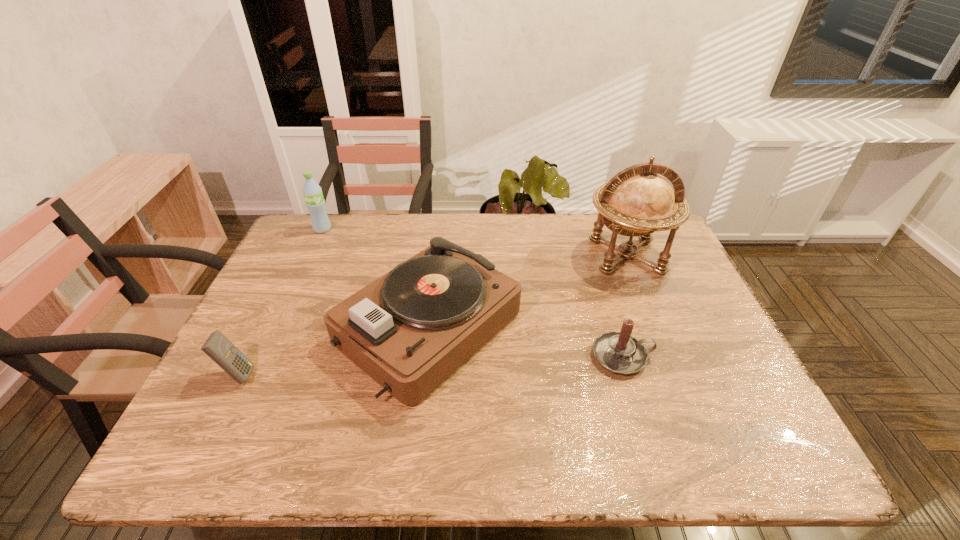
Identify the location of globe present at the far edge. (637, 201).

Identify the location of water bottle positioned at the far edge. This screenshot has width=960, height=540. (312, 192).

In order to click on water bottle that is positioned at the left edge in this screenshot , I will do `click(312, 192)`.

The height and width of the screenshot is (540, 960). In order to click on calculator that is at the left edge in this screenshot , I will do `click(222, 351)`.

Where is `object that is at the right edge`? The image size is (960, 540). object that is at the right edge is located at coordinates (637, 201).

This screenshot has height=540, width=960. I want to click on object that is at the far left corner, so click(312, 192).

You are a GUI agent. You are given a task and a screenshot of the screen. Output one action in this format:
    pyautogui.click(x=<x>, y=<y>)
    Task: Click on the object situated at the far right corner
    
    Given the screenshot: What is the action you would take?
    pyautogui.click(x=637, y=201)

This screenshot has width=960, height=540. Identify the location of vacant space at the far edge. (586, 233).

Locate an element on the screen. free space at the near edge of the desktop is located at coordinates (454, 424).

You are a GUI agent. You are given a task and a screenshot of the screen. Output one action in this format:
    pyautogui.click(x=<x>, y=<y>)
    Task: Click on the vacant space at the left edge
    The image size is (960, 540).
    Given the screenshot: What is the action you would take?
    coord(261,310)